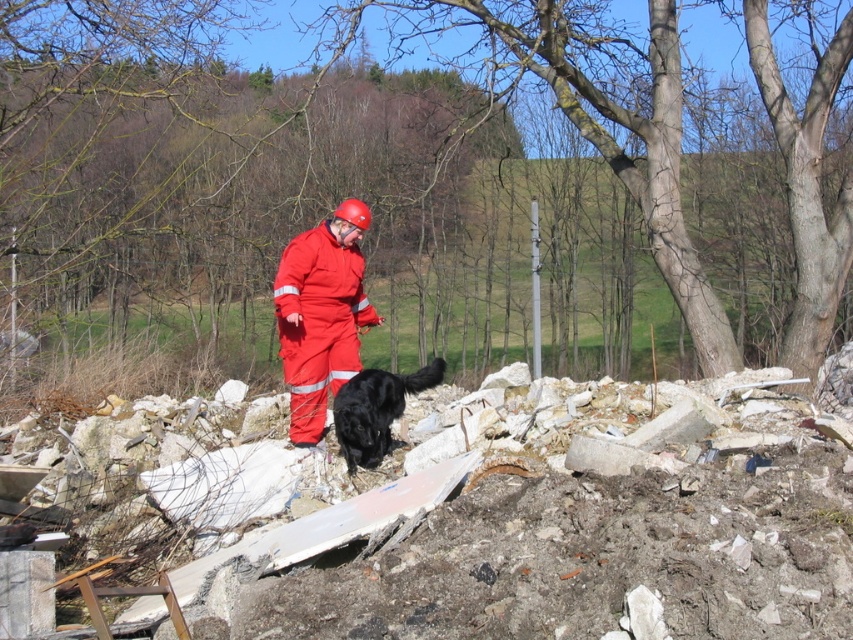
Does matte red jumpsuit at center appear on the right side of black fur dog at center?

In fact, matte red jumpsuit at center is to the left of black fur dog at center.

Does point (334, 268) come farther from viewer compared to point (363, 401)?

Yes, point (334, 268) is farther from viewer.

Where is `matte red jumpsuit at center`? matte red jumpsuit at center is located at coordinates (321, 314).